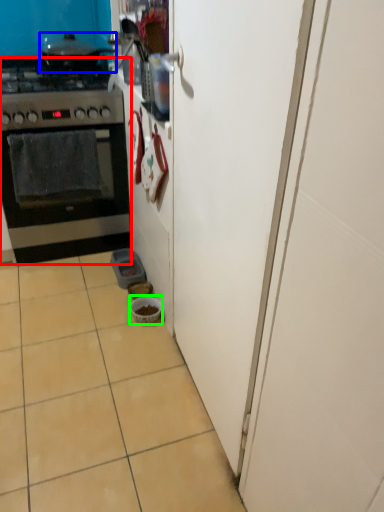
Question: Which object is positioned farthest from kitchen appliance (highlighted by a red box)? Select from open (highlighted by a blue box) and bowl (highlighted by a green box).

Choices:
 (A) open
 (B) bowl

Answer: (B)